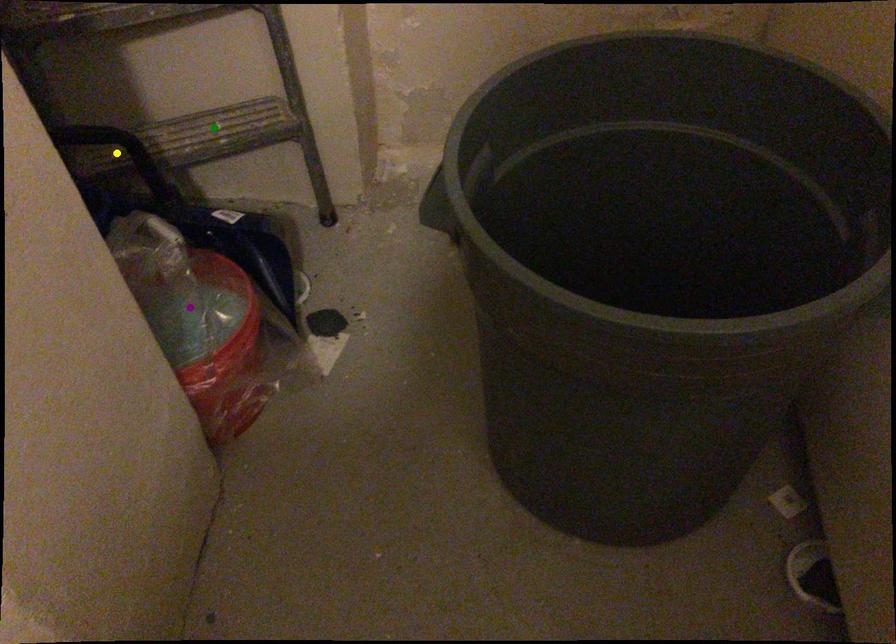
Order these from farthest to nearest:
- purple point
- green point
- yellow point

green point
yellow point
purple point